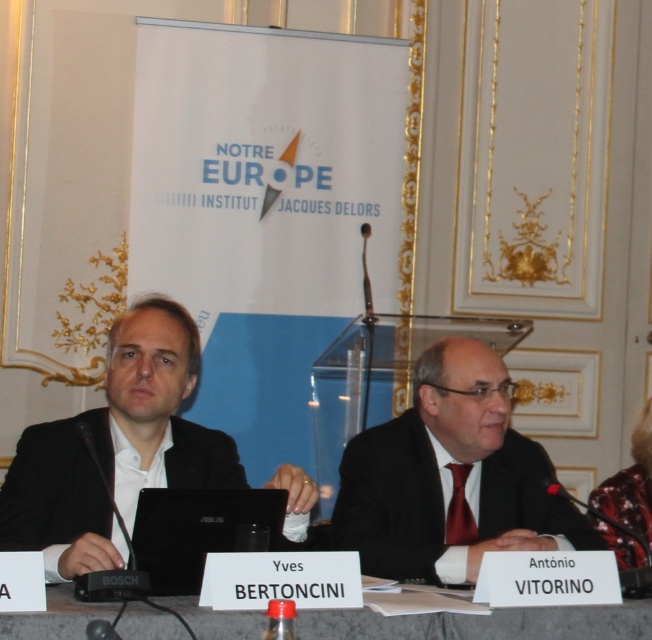
Question: Is black suit at center to the left of white paper at center from the viewer's perspective?

Choices:
 (A) no
 (B) yes

Answer: (A)

Question: Among these points, which one is nearest to the camera?

Choices:
 (A) (361, 496)
 (B) (82, 616)
 (C) (194, 458)
 (D) (645, 480)

Answer: (B)

Question: Does black suit at center appear over white paper at center?

Choices:
 (A) no
 (B) yes

Answer: (B)

Question: Which point is closer to the camera taking this photo?

Choices:
 (A) (647, 547)
 (B) (113, 384)

Answer: (A)

Question: Can you confirm if white paper at center is thinner than black matte laptop at center?

Choices:
 (A) yes
 (B) no

Answer: (B)

Question: Which of the following is the closest to the observer?

Choices:
 (A) (640, 444)
 (B) (67, 628)

Answer: (B)